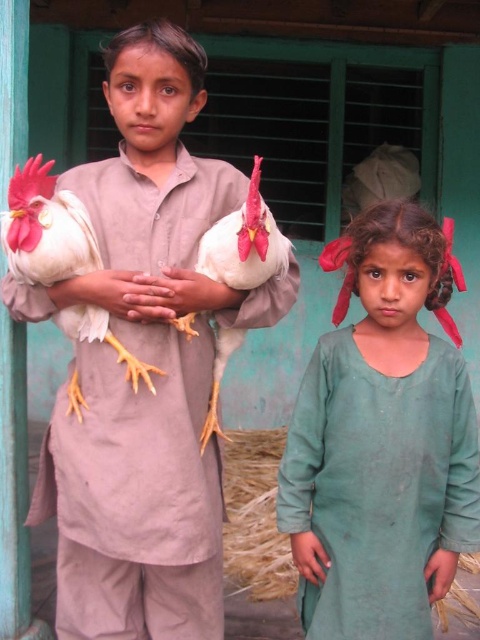
Measure the distance from white feathered rooster at left to white feathered chicken at left.

7.09 inches

Does white feathered rooster at left appear over white feathered chicken at left?

Actually, white feathered rooster at left is below white feathered chicken at left.

You are a GUI agent. You are given a task and a screenshot of the screen. Output one action in this format:
    pyautogui.click(x=<x>, y=<y>)
    Task: Click on the white feathered rooster at left
    This screenshot has height=640, width=480.
    Given the screenshot: What is the action you would take?
    pyautogui.click(x=144, y=358)

Identify the location of white feathered rooster at left. (144, 358).

Is white feathered rooster at left wider than green fabric dress at lower right?

Yes.

Is white feathered rooster at left thinner than green fabric dress at lower right?

Incorrect, white feathered rooster at left's width is not less than green fabric dress at lower right's.

Where is `white feathered rooster at left`? The height and width of the screenshot is (640, 480). white feathered rooster at left is located at coordinates (144, 358).

Can you confirm if green fabric dress at lower right is thinner than white feathered chicken at left?

No, green fabric dress at lower right is not thinner than white feathered chicken at left.

Locate an element on the screen. The width and height of the screenshot is (480, 640). green fabric dress at lower right is located at coordinates (382, 442).

Locate an element on the screen. green fabric dress at lower right is located at coordinates (382, 442).